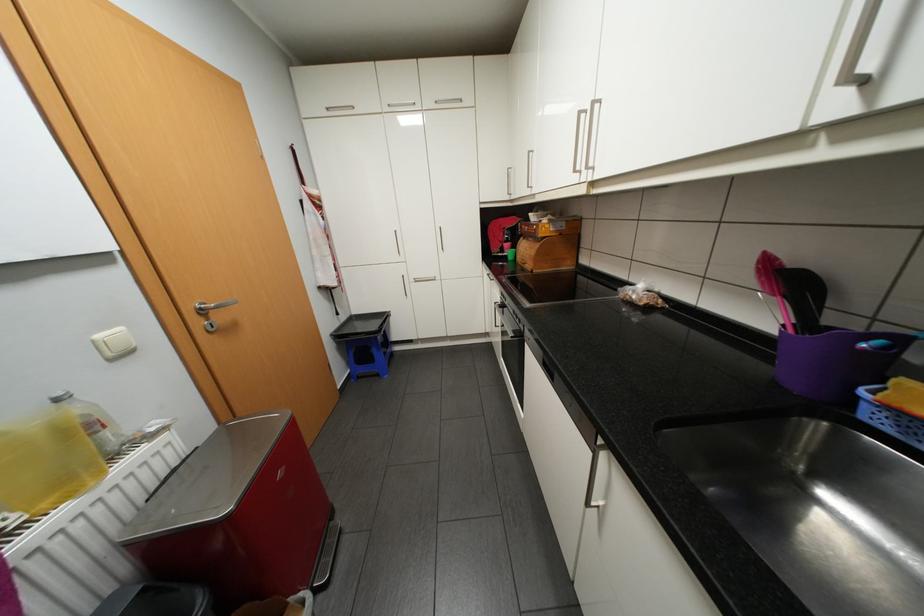
Describe the element at coordinates (59, 395) in the screenshot. I see `a bottle cap` at that location.